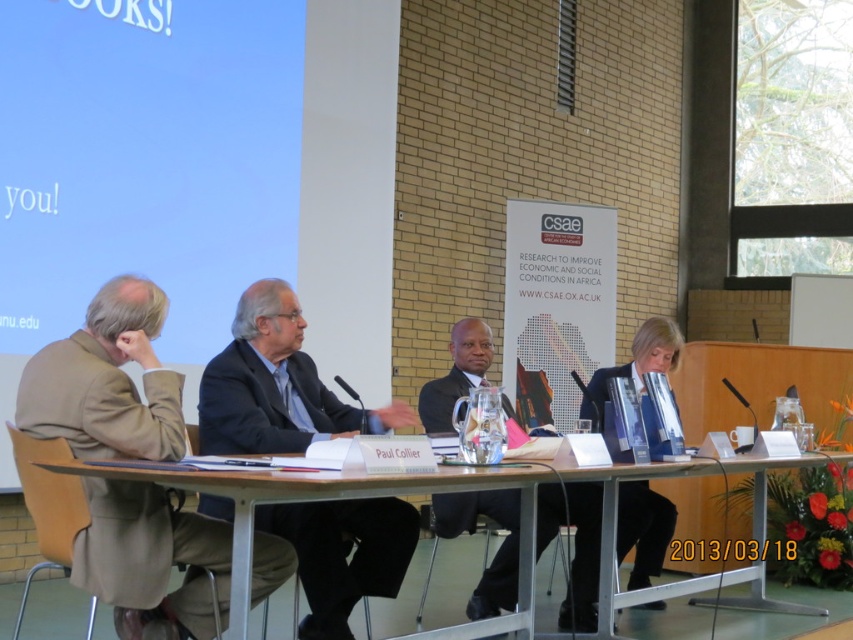
Question: Does dark suit at center appear on the right side of blue fabric jacket at center?

Choices:
 (A) no
 (B) yes

Answer: (A)

Question: Among these objects, which one is nearest to the camera?

Choices:
 (A) clear plastic table at center
 (B) blue fabric jacket at center

Answer: (A)

Question: Which object is positioned farthest from the blue fabric jacket at center?

Choices:
 (A) brown woolen jacket at left
 (B) dark suit at center

Answer: (A)

Question: Which of the following is the closest to the observer?

Choices:
 (A) (129, 637)
 (B) (654, 512)
 (C) (521, 483)

Answer: (A)

Question: Can you confirm if brown woolen jacket at left is positioned to the left of dark suit at center?

Choices:
 (A) no
 (B) yes

Answer: (B)

Question: Where is dark suit at center located in relation to clear plastic table at center in the image?

Choices:
 (A) above
 (B) below

Answer: (A)